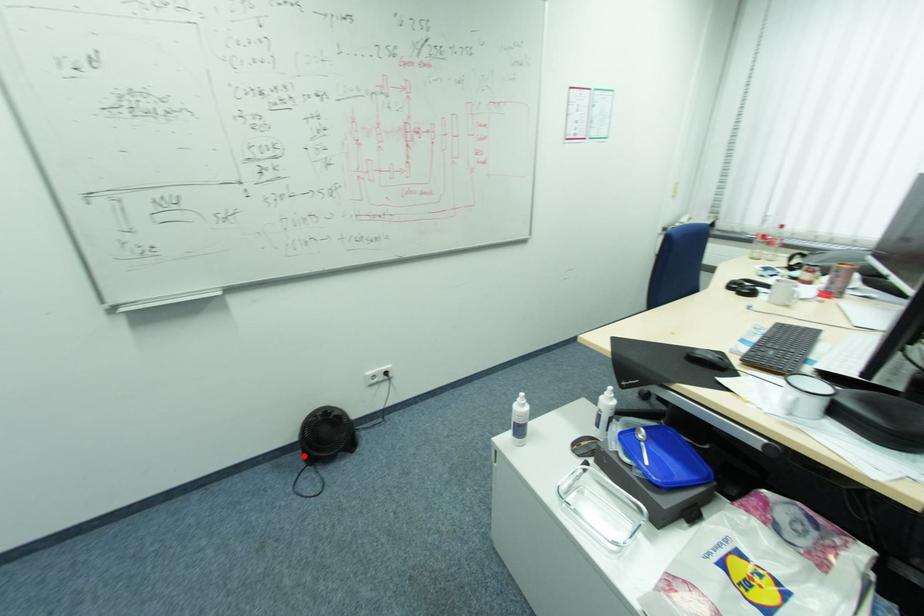
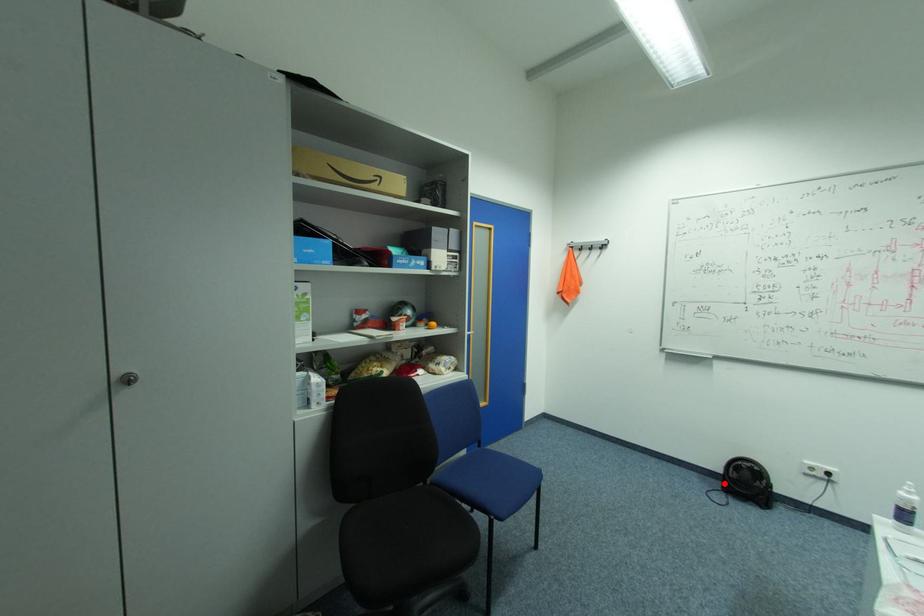
I am providing you with two images of the same scene from different viewpoints. A red point is marked on the first image and another point is marked on the second image. Do the highlighted points in image1 and image2 indicate the same real-world spot?

Yes